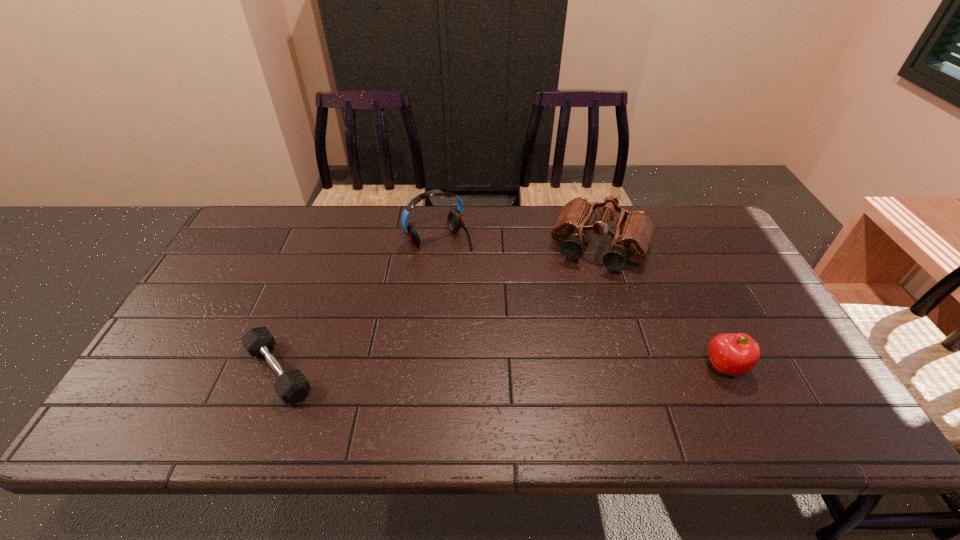
What are the coordinates of `free spot on the desktop that is between the dumbbell and the apple and is positioned with the microphone attached to the side of the headset` in the screenshot? It's located at (546, 369).

The width and height of the screenshot is (960, 540). In order to click on free space on the desktop that is between the shortest object and the second shortest object and is positioned through the eyepieces of the binoculars in this screenshot , I will do pos(554,369).